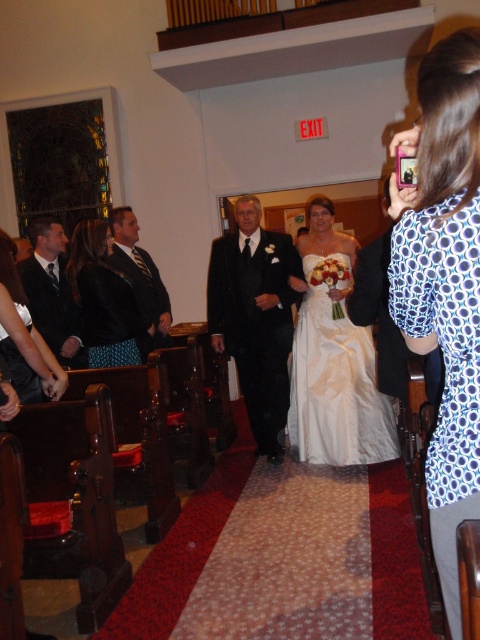
You are standing at the entrance of the church and see two points marked in the image. The first point is at coordinate point(x=253, y=433) and the second is at point(x=147, y=276). Which point is closer to the altar located at the far end of the aisle?

Point(x=253, y=433) is in front of point(x=147, y=276), so it is closer to the altar located at the far end of the aisle.

From the picture: You are a photographer positioned at the back of the church during a wedding. You need to capture a photo of the blue dotted blouse at right and the shiny black suit at center. Based on their positions, which one is closer to the ground?

The blue dotted blouse at right is below shiny black suit at center, so it is closer to the ground.